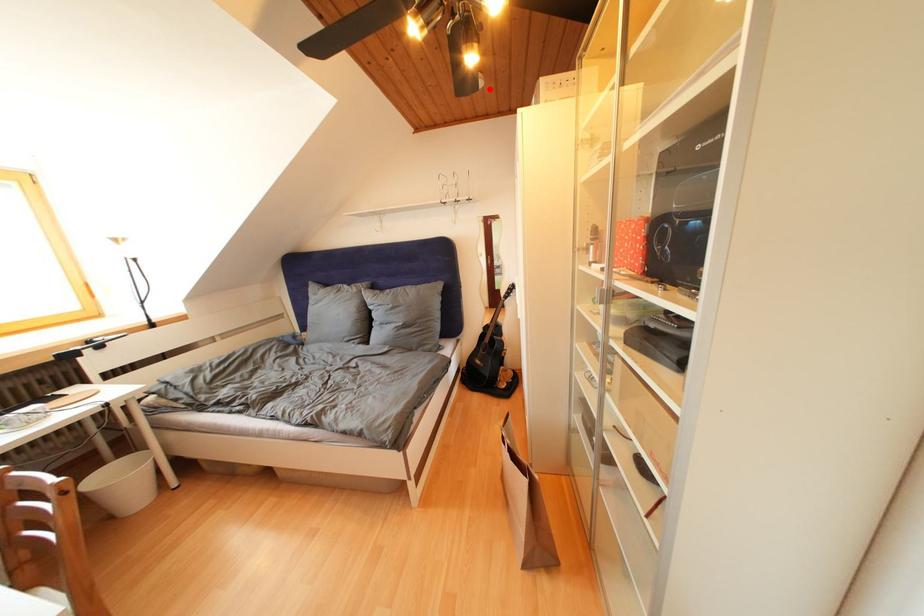
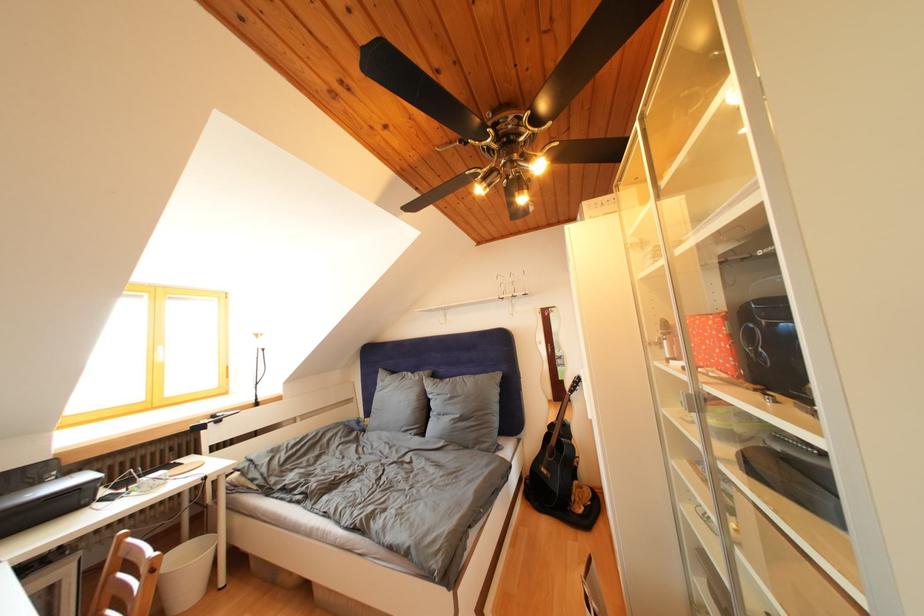
Question: I am providing you with two images of the same scene from different viewpoints. A red point is marked on the first image. Is the red point's position out of view in image 2?

Choices:
 (A) Yes
 (B) No

Answer: (B)